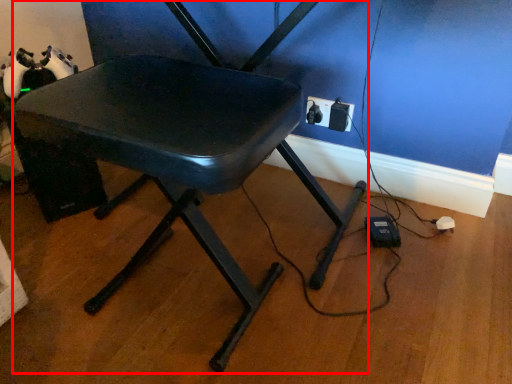
Question: From the image's perspective, what is the correct spatial positioning of chair (annotated by the red box) in reference to electric outlet?

Choices:
 (A) below
 (B) above

Answer: (A)